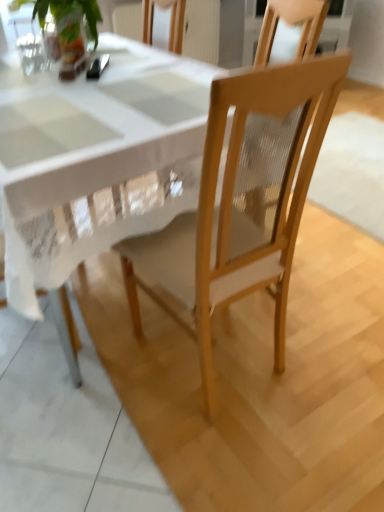
This screenshot has height=512, width=384. In order to click on free space in front of light wood chair at center in this screenshot , I will do `click(217, 452)`.